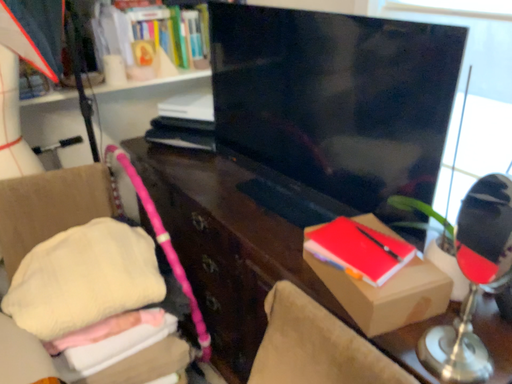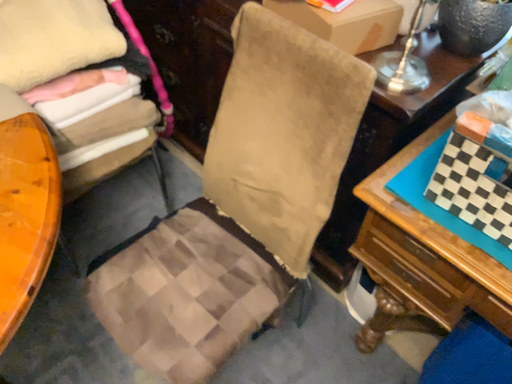
Question: Which way did the camera rotate in the video?

Choices:
 (A) rotated upward
 (B) rotated downward

Answer: (B)